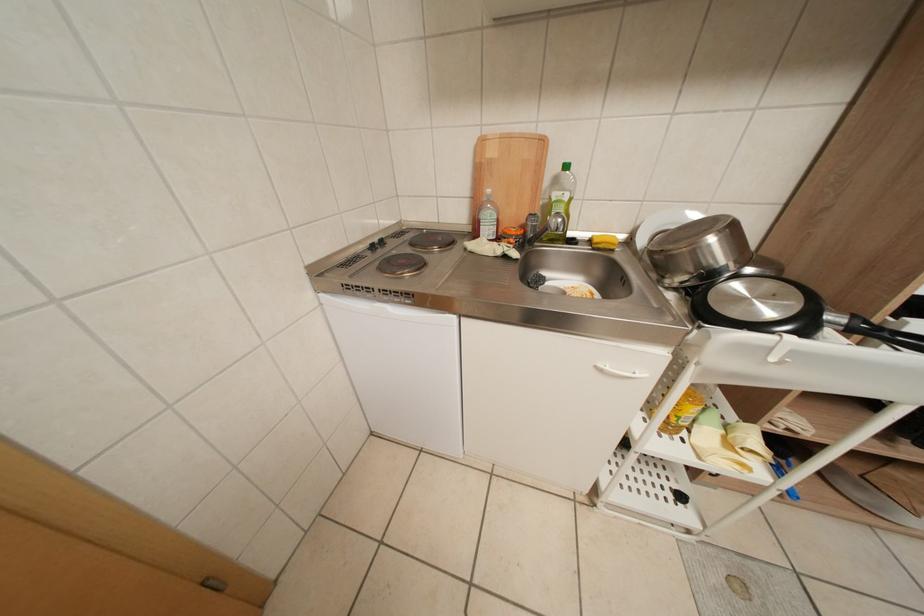
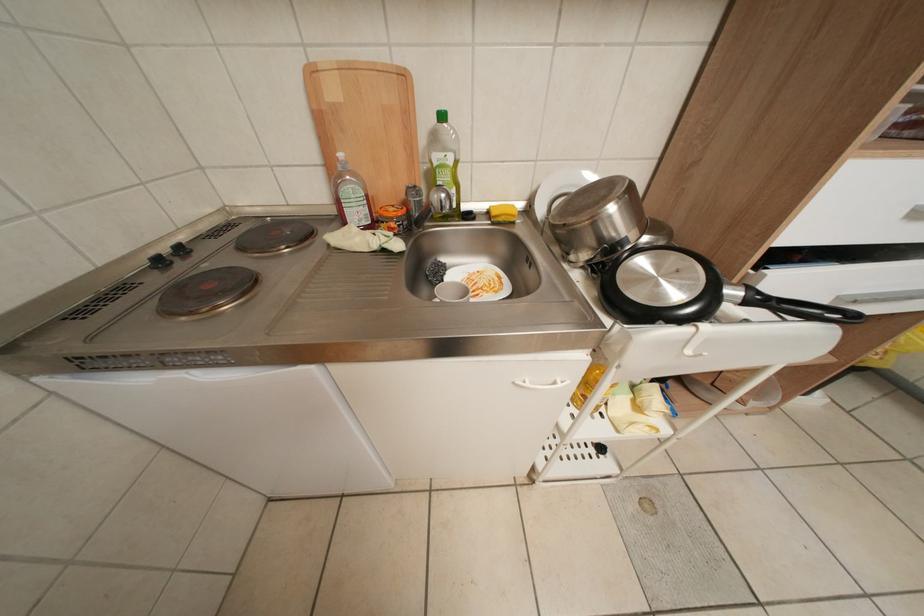
Question: How did the camera likely rotate?

Choices:
 (A) Left
 (B) Right
 (C) Up
 (D) Down

Answer: (B)